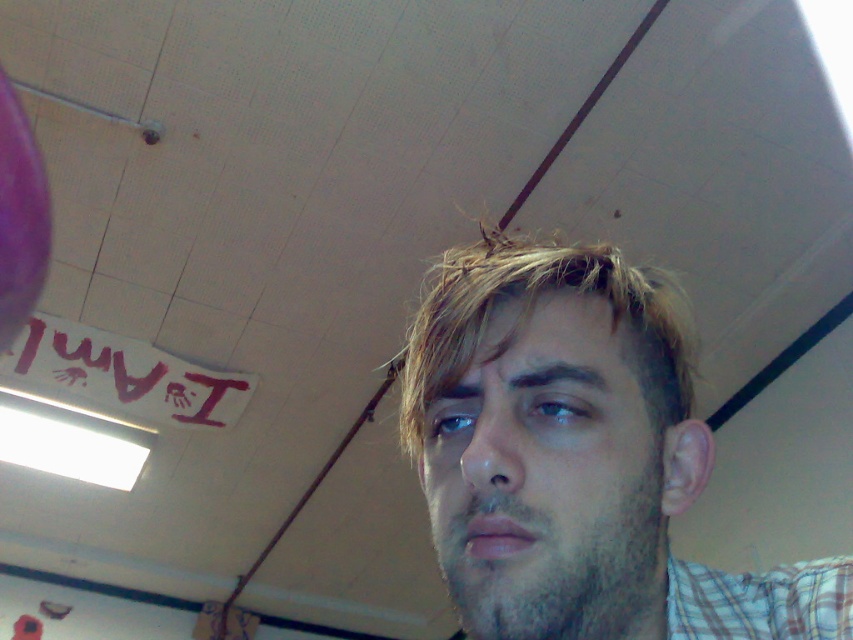
Question: Which point is closer to the camera?

Choices:
 (A) light brown hair at center
 (B) handprint graffiti at upper left

Answer: (A)

Question: Observing the image, what is the correct spatial positioning of light brown hair at center in reference to handprint graffiti at upper left?

Choices:
 (A) right
 (B) left

Answer: (A)

Question: Does light brown hair at center have a smaller size compared to handprint graffiti at upper left?

Choices:
 (A) no
 (B) yes

Answer: (B)

Question: Based on their relative distances, which object is farther from the light brown hair at center?

Choices:
 (A) handprint graffiti at upper left
 (B) plaid fabric at lower right

Answer: (A)

Question: Can you confirm if handprint graffiti at upper left is wider than plaid fabric at lower right?

Choices:
 (A) yes
 (B) no

Answer: (A)

Question: Which point is closer to the camera taking this photo?

Choices:
 (A) pos(166,387)
 (B) pos(614,400)
 (C) pos(758,620)

Answer: (B)